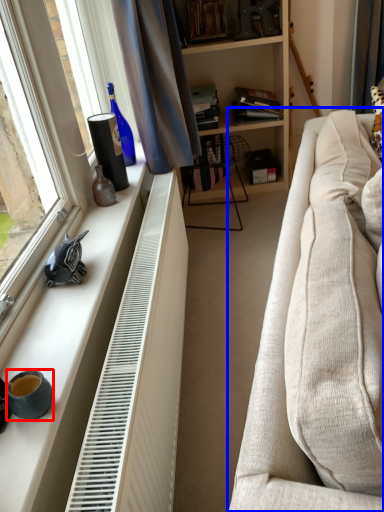
Question: Which point is closer to the camera, coffee cup (highlighted by a red box) or studio couch (highlighted by a blue box)?

Choices:
 (A) coffee cup
 (B) studio couch

Answer: (B)